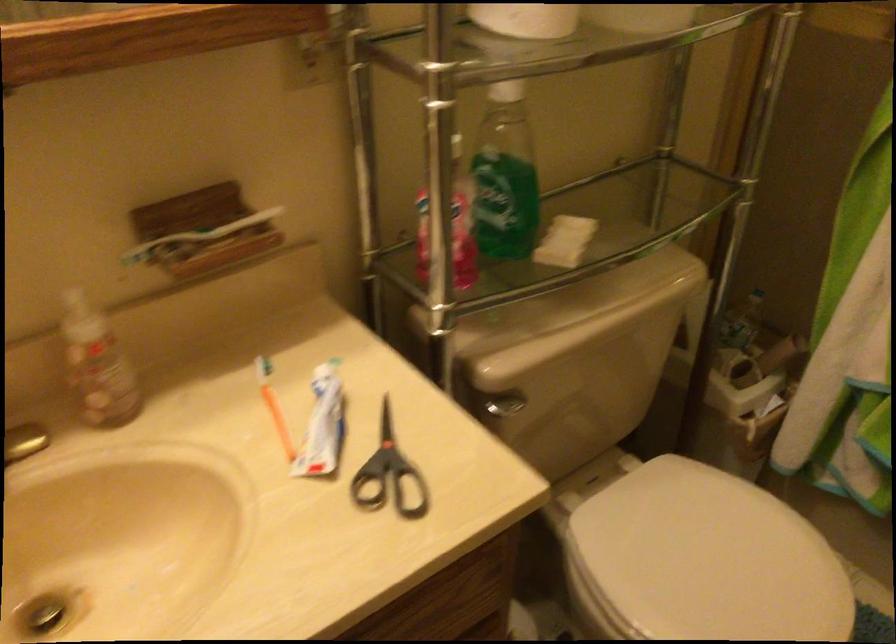
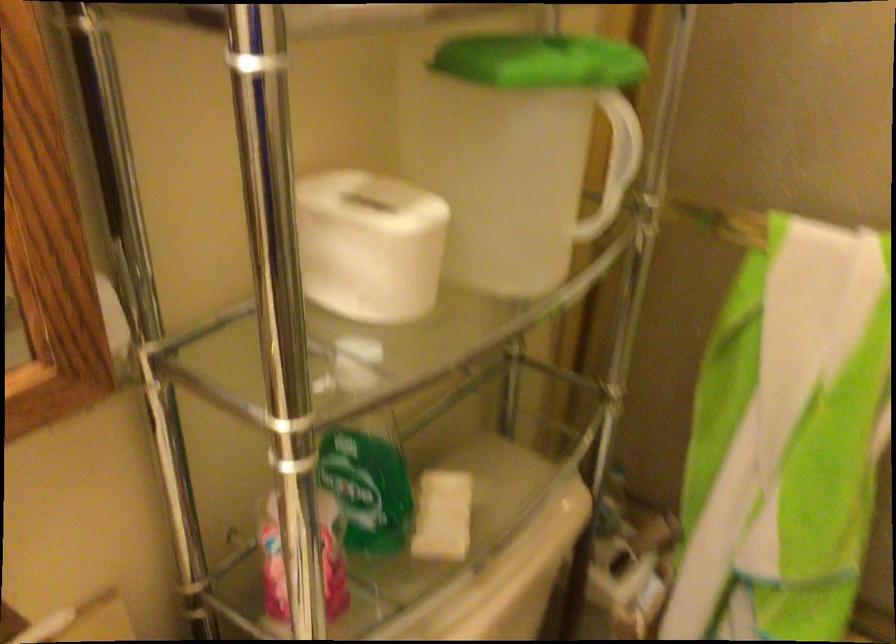
Locate, in the second image, the point that corresponds to (560,240) in the first image.

(442, 516)